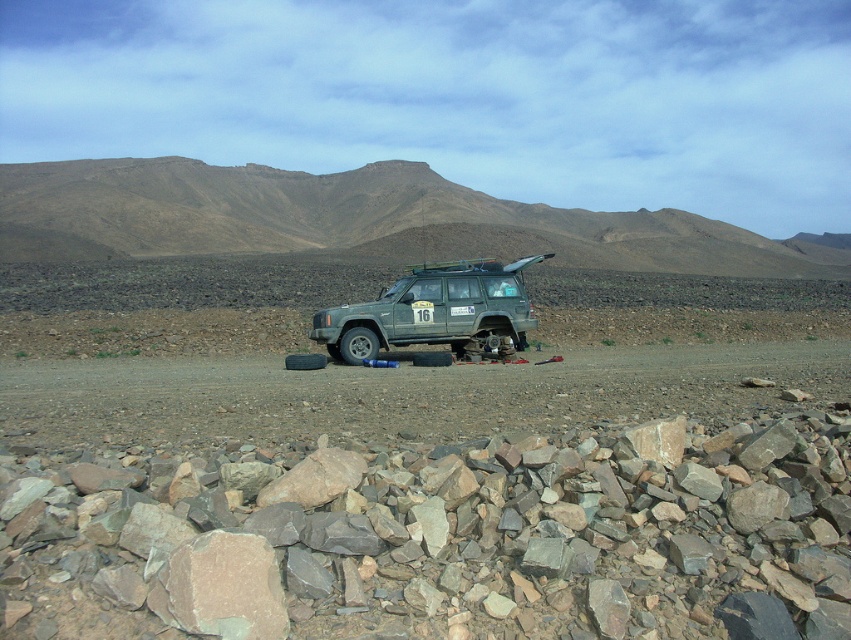
Is brown rocky mountain at upper center below green matte jeep at center?

No.

Can you confirm if brown rocky mountain at upper center is smaller than green matte jeep at center?

No.

Does point (798, 268) come in front of point (467, 349)?

No, (798, 268) is further to viewer.

This screenshot has width=851, height=640. In order to click on brown rocky mountain at upper center in this screenshot , I will do `click(358, 220)`.

Which of these two, rusty stone pile at center or green matte jeep at center, stands taller?

With more height is green matte jeep at center.

The image size is (851, 640). In order to click on rusty stone pile at center in this screenshot , I will do `click(449, 540)`.

Is point (61, 467) farther from camera compared to point (483, 348)?

No, it is in front of (483, 348).

You are a GUI agent. You are given a task and a screenshot of the screen. Output one action in this format:
    pyautogui.click(x=<x>, y=<y>)
    Task: Click on the rusty stone pile at center
    This screenshot has height=640, width=851.
    Given the screenshot: What is the action you would take?
    pyautogui.click(x=449, y=540)

Based on the photo, who is higher up, rusty stone pile at center or brown rocky mountain at upper center?

brown rocky mountain at upper center is higher up.

Is rusty stone pile at center below brown rocky mountain at upper center?

Correct, rusty stone pile at center is located below brown rocky mountain at upper center.

Which is in front, point (397, 627) or point (77, 230)?

Point (397, 627) is more forward.

Identify the location of rusty stone pile at center. (449, 540).